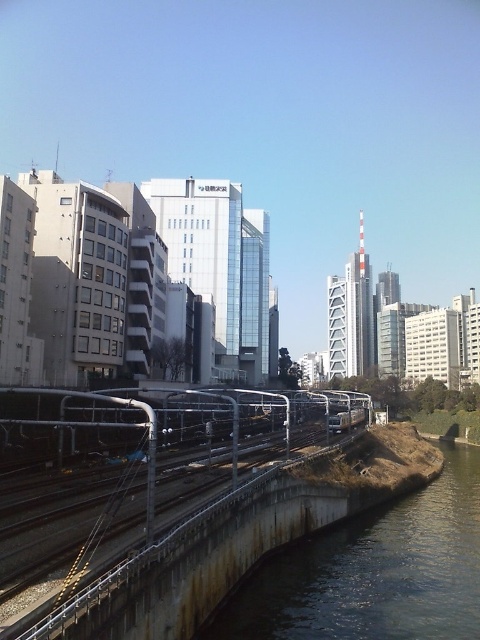
Is point (462, 497) closer to viewer compared to point (360, 420)?

Yes, point (462, 497) is closer to viewer.

Who is lower down, brown concrete river at lower right or silver metallic passenger train at center?

brown concrete river at lower right

Locate an element on the screen. The height and width of the screenshot is (640, 480). brown concrete river at lower right is located at coordinates (374, 570).

Is brown concrete river at lower right to the right of metallic rail at center from the viewer's perspective?

Yes, brown concrete river at lower right is to the right of metallic rail at center.

Does brown concrete river at lower right have a lesser height compared to metallic rail at center?

Correct, brown concrete river at lower right is not as tall as metallic rail at center.

This screenshot has width=480, height=640. Identify the location of brown concrete river at lower right. (374, 570).

I want to click on brown concrete river at lower right, so (374, 570).

Is metallic rail at center positioned before silver metallic passenger train at center?

Yes, metallic rail at center is in front of silver metallic passenger train at center.

Which is below, metallic rail at center or silver metallic passenger train at center?

Positioned lower is silver metallic passenger train at center.

Who is more distant from viewer, [342,410] or [359,422]?

The point [342,410] is more distant.

This screenshot has width=480, height=640. I want to click on metallic rail at center, so click(x=178, y=465).